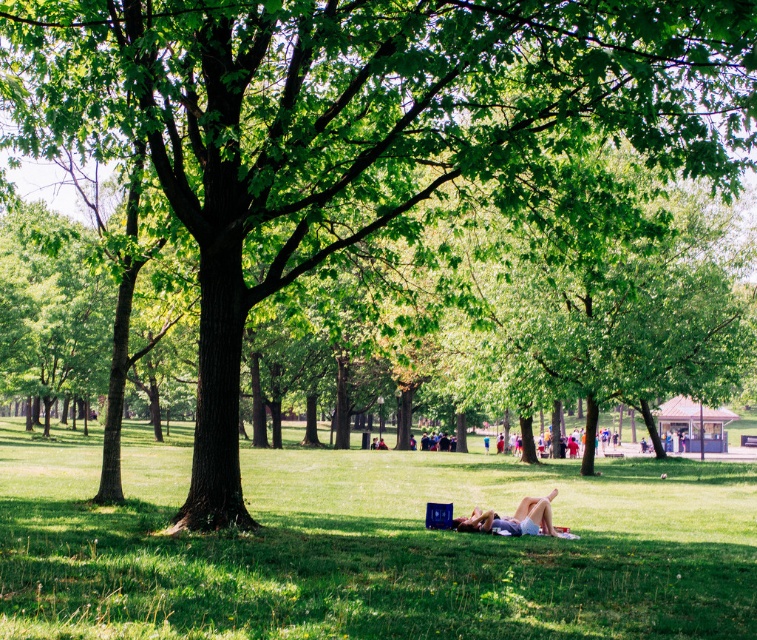
Does green grassy at center have a lesser width compared to light blue denim shorts at center?

In fact, green grassy at center might be wider than light blue denim shorts at center.

Is point (559, 614) positioned before point (500, 528)?

That is True.

Is point (567, 499) in front of point (505, 531)?

No, (567, 499) is behind (505, 531).

Where is `green grassy at center`? This screenshot has width=757, height=640. green grassy at center is located at coordinates (369, 545).